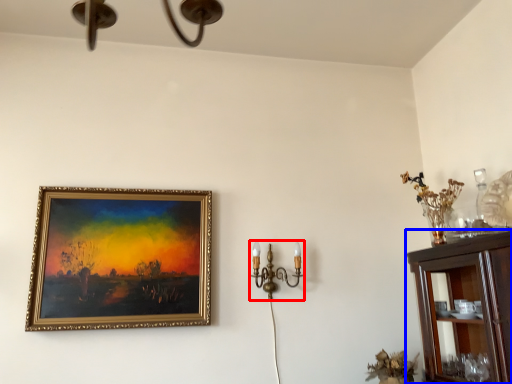
Question: Which point is closer to the camera, candle holder (highlighted by a red box) or cabinetry (highlighted by a blue box)?

Choices:
 (A) candle holder
 (B) cabinetry

Answer: (B)